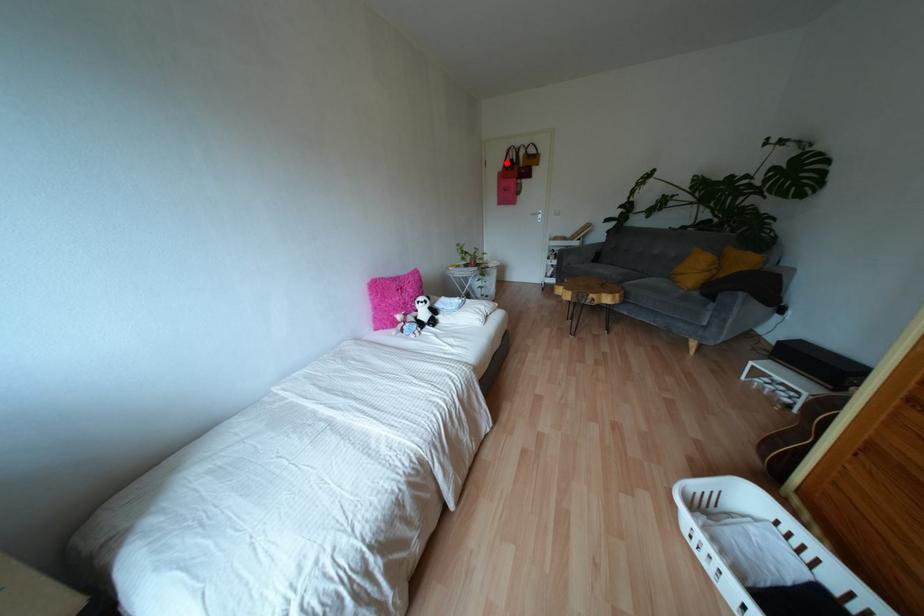
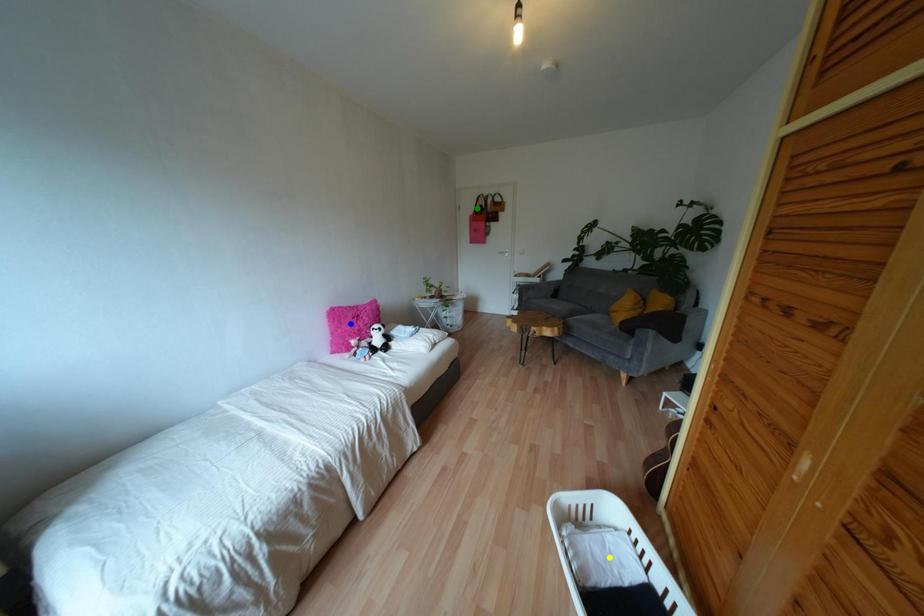
Question: I am providing you with two images of the same scene from different viewpoints. A red point is marked on the first image. You are given multiple points on the second image. In image 2, which mark is for the same physical point as the one in image 1?

Choices:
 (A) green point
 (B) blue point
 (C) yellow point

Answer: (A)